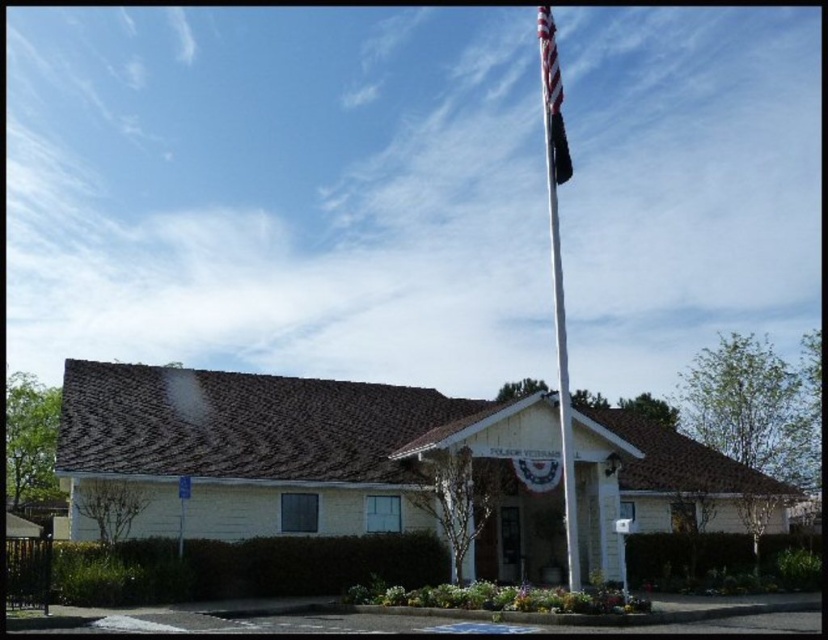
You are a visitor approaching the building and notice the white metallic flag pole at upper center and the american flag at upper right. Which object is positioned lower in the image?

The white metallic flag pole at upper center is positioned below the american flag at upper right, so it is lower in the image.

You are standing in front of the building and want to determine which of the two points, point [566,170] or point [570,164], is closer to you. Based on the scene, which point is nearer?

Point [566,170] is closer to the viewer than point [570,164].

You are a photographer positioned in front of the building. You want to capture a photo of the american flag at upper right without the white metallic flag pole at upper center blocking it. Is it possible to do so from your current position?

The american flag at upper right is behind the white metallic flag pole at upper center, so it is blocked by the pole. Therefore, you cannot capture a clear photo of the american flag at upper right without the white metallic flag pole at upper center blocking it from your current position.